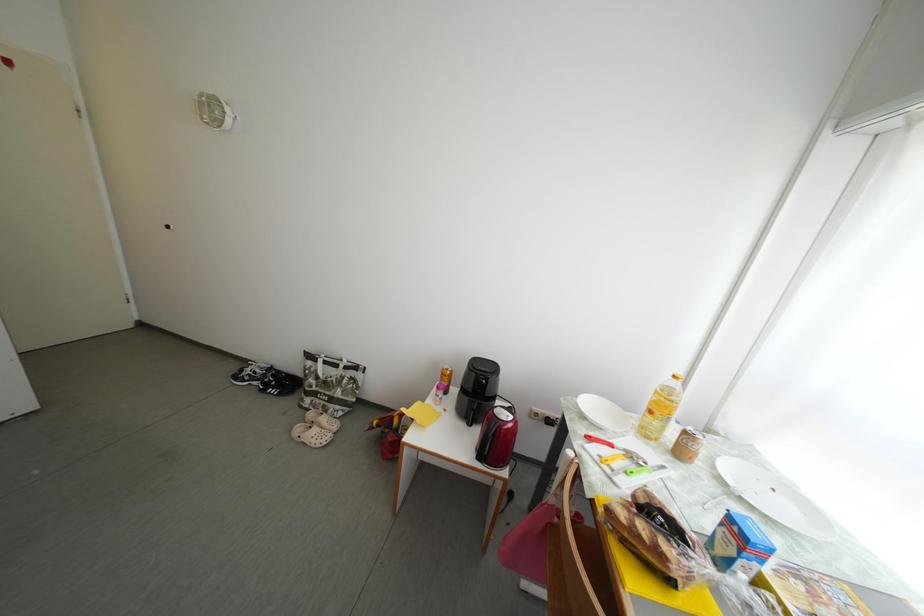
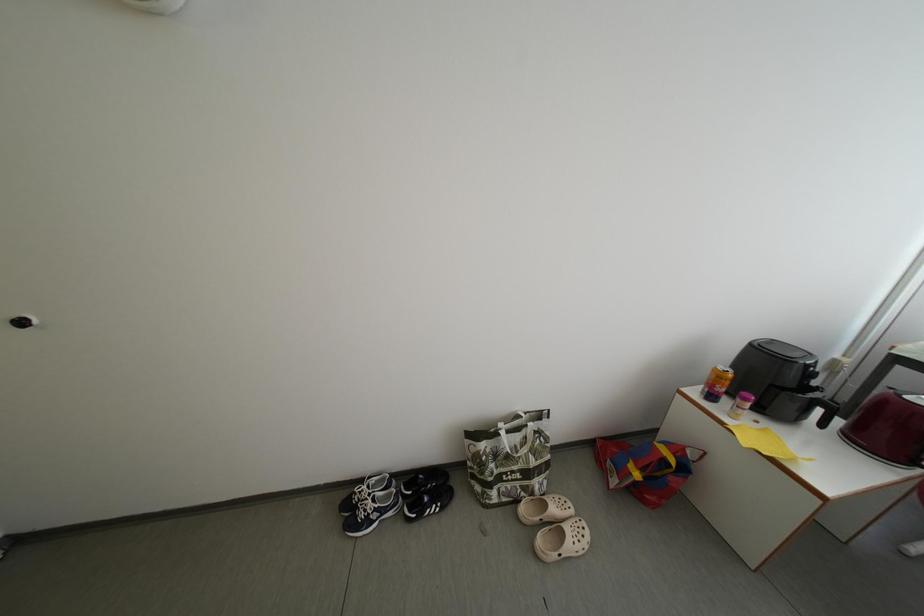
What movement of the cameraman would produce the second image?

The cameraman walked toward left, forward.